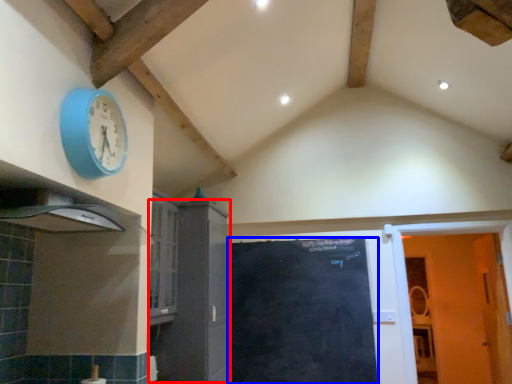
Question: Which object appears farthest to the camera in this image, cabinetry (highlighted by a red box) or door (highlighted by a blue box)?

Choices:
 (A) cabinetry
 (B) door

Answer: (B)